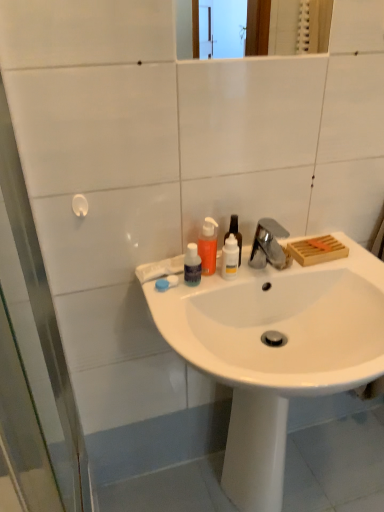
The height and width of the screenshot is (512, 384). In order to click on vacant area that is in front of transparent plastic bottle at center, placed as the 1th bottle when sorted from right to left in this screenshot , I will do `click(208, 292)`.